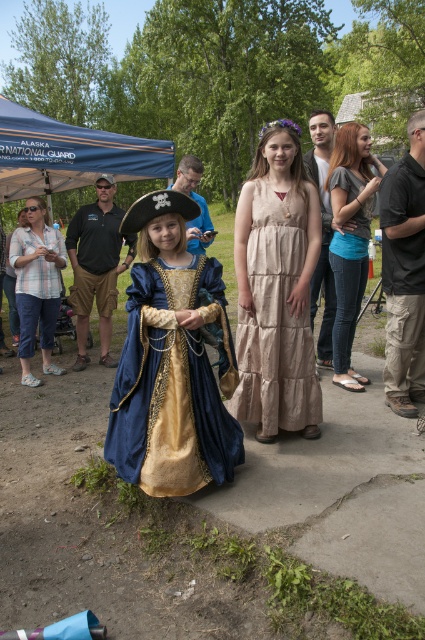
You are organizing a photo shoot and need to arrange the beige cotton dress at center and the blue jeans at right in a row. If you want to place them side by side without overlapping, which one should you position first to accommodate their widths?

The beige cotton dress at center is wider than the blue jeans at right, so you should position the beige cotton dress at center first to ensure there is enough space for both when placed side by side.

You are a photographer trying to capture the beige cotton dress at center in your shot. Based on the coordinates provided, where should you position your camera to ensure the dress is centered in the frame?

The beige cotton dress at center is located at point coordinates, so positioning the camera directly facing those coordinates will center the dress in the frame.

You are a photographer at the community event and want to take a photo of the beige cotton dress at center and the blue fabric canopy at upper left. Where should you position yourself to ensure both are in the frame?

Position yourself so the beige cotton dress at center is below the blue fabric canopy at upper left in the frame.